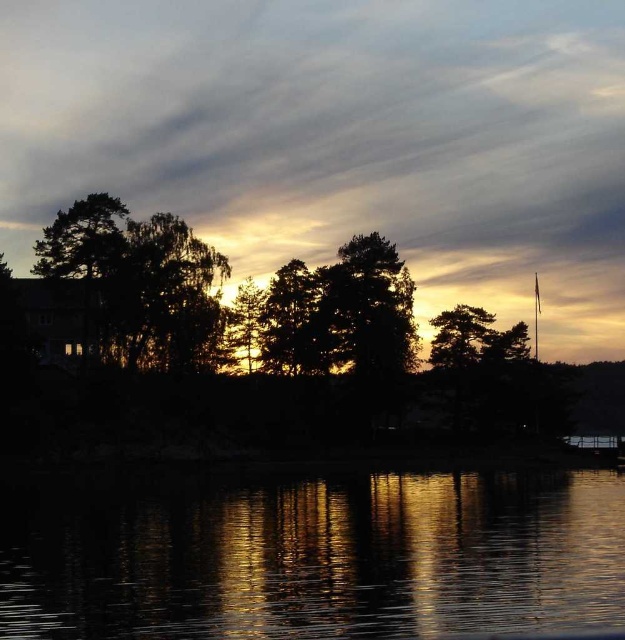
Question: Can you confirm if glistening reflective water at center is thinner than green matte tree at center?

Choices:
 (A) no
 (B) yes

Answer: (A)

Question: Which point is closer to the camera?

Choices:
 (A) (312, 362)
 (B) (502, 138)
 (C) (340, 584)

Answer: (C)

Question: Is silhouette tree at center positioned before green matte tree at center?

Choices:
 (A) yes
 (B) no

Answer: (A)

Question: Estimate the real-world distances between objects in this image. Which object is farther from the silhouette tree at center?

Choices:
 (A) glistening reflective water at center
 (B) green matte tree at center
 (C) golden translucent clouds at upper center

Answer: (C)

Question: Does glistening reflective water at center appear under green matte tree at center?

Choices:
 (A) yes
 (B) no

Answer: (A)

Question: Which point is closer to the camera taking this photo?

Choices:
 (A) (432, 28)
 (B) (326, 323)
 (C) (316, 344)
 (D) (12, 528)

Answer: (D)